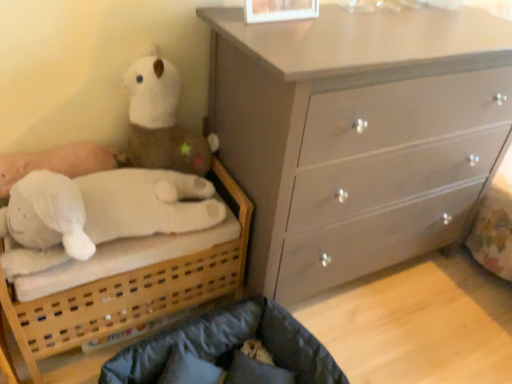
Where is `light gray wooden chest of drawers at upper right`? The image size is (512, 384). light gray wooden chest of drawers at upper right is located at coordinates (357, 135).

Locate an element on the screen. The image size is (512, 384). white plush toy at left is located at coordinates (106, 208).

The height and width of the screenshot is (384, 512). What do you see at coordinates (227, 351) in the screenshot? I see `dark gray fabric infant bed at lower center` at bounding box center [227, 351].

The width and height of the screenshot is (512, 384). What do you see at coordinates (256, 372) in the screenshot? I see `velvety dark blue pillow at lower center` at bounding box center [256, 372].

Image resolution: width=512 pixels, height=384 pixels. What do you see at coordinates (125, 296) in the screenshot? I see `white soft bed at left` at bounding box center [125, 296].

Locate an element on the screen. This screenshot has width=512, height=384. light gray wooden chest of drawers at upper right is located at coordinates (357, 135).

Consider the image. From the image's perspective, is velvety dark blue pillow at lower center on top of light gray wooden chest of drawers at upper right?

Actually, velvety dark blue pillow at lower center appears below light gray wooden chest of drawers at upper right in the image.

Considering the sizes of velvety dark blue pillow at lower center and light gray wooden chest of drawers at upper right in the image, is velvety dark blue pillow at lower center bigger or smaller than light gray wooden chest of drawers at upper right?

velvety dark blue pillow at lower center is smaller than light gray wooden chest of drawers at upper right.

Between point (278, 375) and point (432, 212), which one is positioned behind?

The point (432, 212) is farther from the camera.

Is velvety dark blue pillow at lower center outside of light gray wooden chest of drawers at upper right?

velvety dark blue pillow at lower center lies outside light gray wooden chest of drawers at upper right's area.

From the image's perspective, is white plush toy at upper left under white soft bed at left?

Incorrect, from the image's perspective, white plush toy at upper left is higher than white soft bed at left.

Considering the relative positions of white plush toy at upper left and white soft bed at left in the image provided, is white plush toy at upper left to the left or to the right of white soft bed at left?

Based on their positions, white plush toy at upper left is located to the right of white soft bed at left.

Do you think white plush toy at upper left is within white soft bed at left, or outside of it?

white plush toy at upper left is not enclosed by white soft bed at left.

Can you tell me how much white plush toy at upper left and white soft bed at left differ in facing direction?

They differ by 0.0116 degrees in their facing directions.

Can you confirm if white soft bed at left is thinner than light gray wooden chest of drawers at upper right?

Yes.

Between white soft bed at left and light gray wooden chest of drawers at upper right, which one has less height?

white soft bed at left is shorter.

Is white soft bed at left closer to the viewer compared to light gray wooden chest of drawers at upper right?

No, white soft bed at left is further to the viewer.

Is white soft bed at left next to light gray wooden chest of drawers at upper right?

No, white soft bed at left is not next to light gray wooden chest of drawers at upper right.

Is light gray wooden chest of drawers at upper right not close to white soft bed at left?

light gray wooden chest of drawers at upper right is near white soft bed at left, not far away.

Considering the positions of point (372, 156) and point (3, 361), is point (372, 156) closer or farther from the camera than point (3, 361)?

Point (372, 156) is positioned closer to the camera compared to point (3, 361).

From the image's perspective, which object appears higher, light gray wooden chest of drawers at upper right or white soft bed at left?

light gray wooden chest of drawers at upper right.

Could you tell me if light gray wooden chest of drawers at upper right is turned towards white soft bed at left?

No, light gray wooden chest of drawers at upper right is not turned towards white soft bed at left.

Is white soft bed at left situated inside white plush toy at left or outside?

white soft bed at left is outside white plush toy at left.

In the scene shown: From the image's perspective, is white soft bed at left located above white plush toy at left?

No, from the image's perspective, white soft bed at left is not over white plush toy at left.

Relative to white plush toy at left, is white soft bed at left in front or behind?

white soft bed at left is behind white plush toy at left.

Which of these two, light gray wooden chest of drawers at upper right or velvety dark blue pillow at lower center, stands shorter?

velvety dark blue pillow at lower center.

Which is behind, point (418, 242) or point (258, 375)?

The point (418, 242) is farther from the camera.

The width and height of the screenshot is (512, 384). In order to click on the chest of drawers above the velvety dark blue pillow at lower center (from a real-world perspective) in this screenshot , I will do `click(357, 135)`.

Which object is wider, white plush toy at left or velvety dark blue pillow at lower center?

Wider between the two is white plush toy at left.

Can you confirm if white plush toy at left is shorter than velvety dark blue pillow at lower center?

No.

From the image's perspective, is white plush toy at left located beneath velvety dark blue pillow at lower center?

No, from the image's perspective, white plush toy at left is not below velvety dark blue pillow at lower center.

Is the depth of white plush toy at left greater than that of velvety dark blue pillow at lower center?

No.

Locate an element on the screen. This screenshot has width=512, height=384. the chest of drawers that is above the velvety dark blue pillow at lower center (from the image's perspective) is located at coordinates coord(357,135).

You are a GUI agent. You are given a task and a screenshot of the screen. Output one action in this format:
    pyautogui.click(x=<x>, y=<y>)
    Task: Click on the bed that appears on the left of white plush toy at upper left
    This screenshot has width=512, height=384.
    Given the screenshot: What is the action you would take?
    pyautogui.click(x=125, y=296)

Estimate the real-world distances between objects in this image. Which object is closer to dark gray fabric infant bed at lower center, light gray wooden chest of drawers at upper right or white soft bed at left?

white soft bed at left.

Looking at the image, which one is located further to white plush toy at upper left, light gray wooden chest of drawers at upper right or velvety dark blue pillow at lower center?

Based on the image, velvety dark blue pillow at lower center appears to be further to white plush toy at upper left.

Which object lies further to the anchor point white plush toy at left, white soft bed at left or light gray wooden chest of drawers at upper right?

light gray wooden chest of drawers at upper right is further to white plush toy at left.

When comparing their distances from white plush toy at upper left, does white plush toy at left or dark gray fabric infant bed at lower center seem further?

dark gray fabric infant bed at lower center is positioned further to the anchor white plush toy at upper left.

Consider the image. From the image, which object appears to be nearer to white soft bed at left, light gray wooden chest of drawers at upper right or white plush toy at upper left?

Based on the image, white plush toy at upper left appears to be nearer to white soft bed at left.

Which object lies nearer to the anchor point dark gray fabric infant bed at lower center, velvety dark blue pillow at lower center or light gray wooden chest of drawers at upper right?

velvety dark blue pillow at lower center is positioned closer to the anchor dark gray fabric infant bed at lower center.

When comparing their distances from white plush toy at upper left, does dark gray fabric infant bed at lower center or white plush toy at left seem closer?

white plush toy at left is positioned closer to the anchor white plush toy at upper left.

Looking at the image, which one is located further to velvety dark blue pillow at lower center, white soft bed at left or light gray wooden chest of drawers at upper right?

Based on the image, light gray wooden chest of drawers at upper right appears to be further to velvety dark blue pillow at lower center.

Locate an element on the screen. animal that lies between white plush toy at upper left and white soft bed at left from top to bottom is located at coordinates click(106, 208).

Locate an element on the screen. The image size is (512, 384). infant bed situated between white soft bed at left and velvety dark blue pillow at lower center from left to right is located at coordinates tap(227, 351).

Locate an element on the screen. The image size is (512, 384). pillow between white soft bed at left and light gray wooden chest of drawers at upper right from left to right is located at coordinates (256, 372).

The image size is (512, 384). Find the location of `animal between white plush toy at upper left and velvety dark blue pillow at lower center vertically`. animal between white plush toy at upper left and velvety dark blue pillow at lower center vertically is located at coordinates (106, 208).